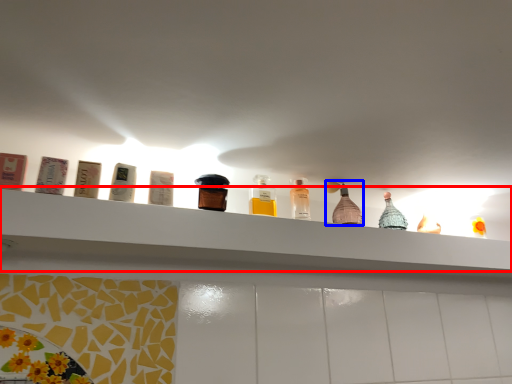
Question: Which object is further to the camera taking this photo, shelf (highlighted by a red box) or bottle (highlighted by a blue box)?

Choices:
 (A) shelf
 (B) bottle

Answer: (B)